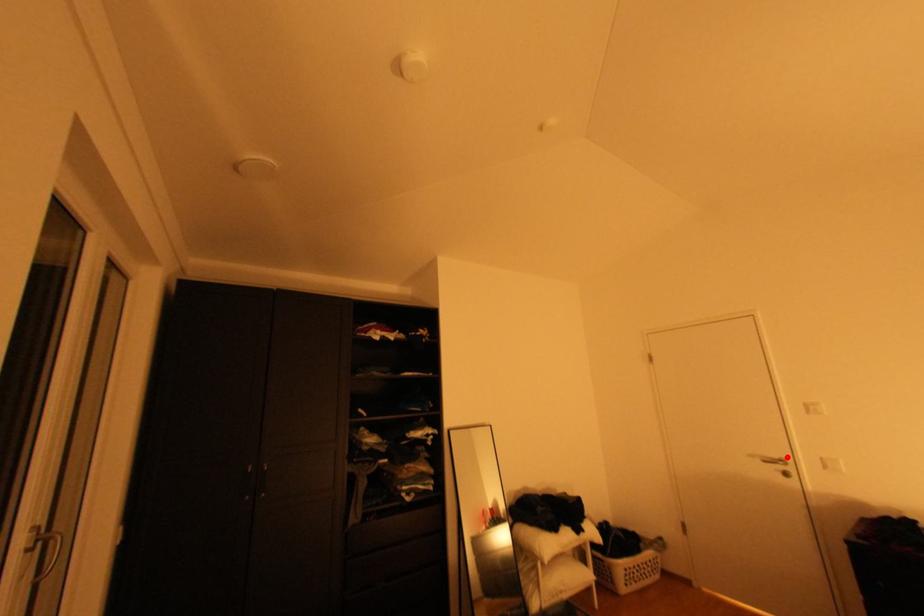
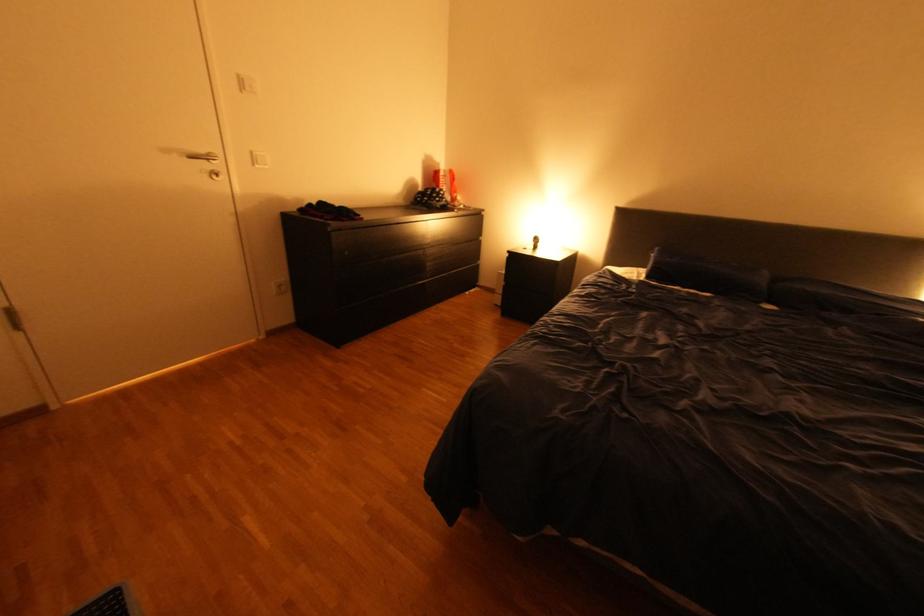
Question: I am providing you with two images of the same scene from different viewpoints. A red point is marked on the first image. At the location where the point appears in image 1, is it still visible in image 2?

Choices:
 (A) Yes
 (B) No

Answer: (A)